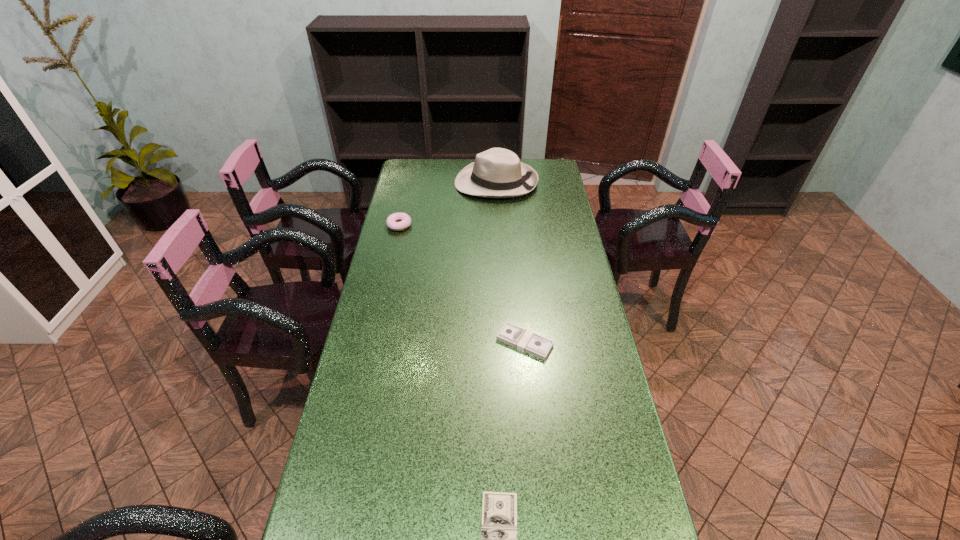
At what (x,y) coordinates should I click in order to perform the action: click on free spot that satisfies the following two spatial constraints: 1. on the front-facing side of the tallest object; 2. on the front side of the leftmost object. Please return your answer as a coordinate pair (x, y). The width and height of the screenshot is (960, 540). Looking at the image, I should click on (498, 225).

Identify the location of free space that satisfies the following two spatial constraints: 1. on the front-facing side of the fedora; 2. on the front side of the leftmost object. (498, 225).